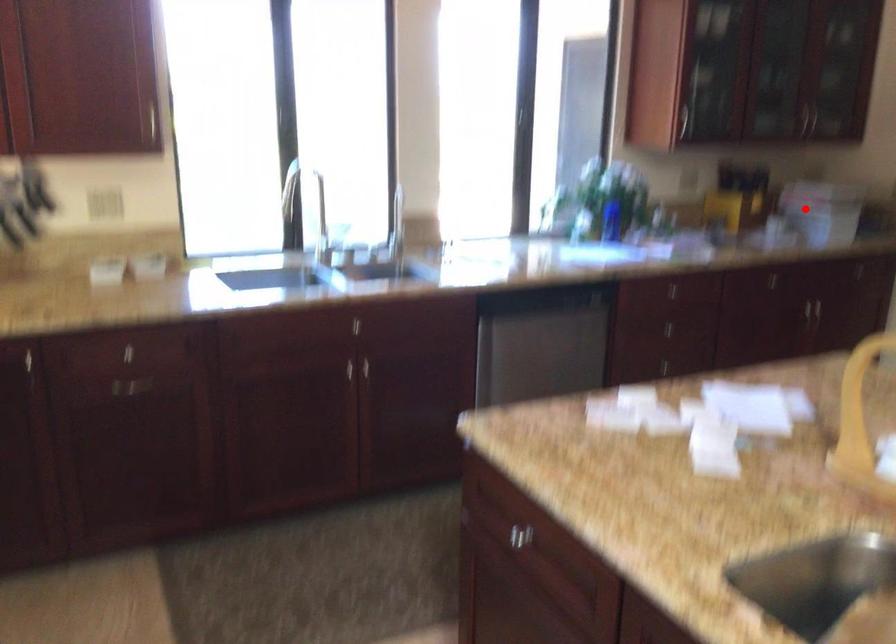
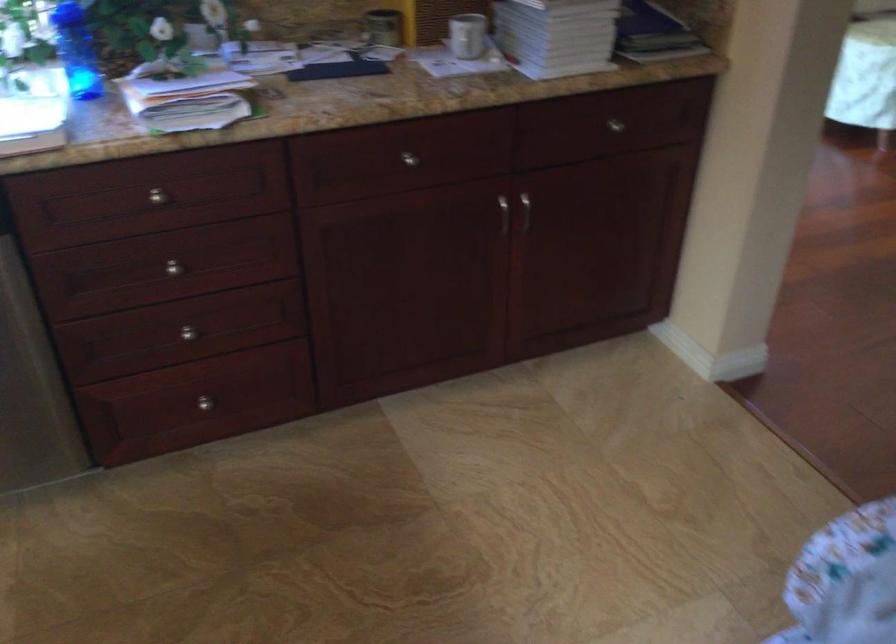
Find the pixel in the second image that matches the highlighted location in the first image.

(467, 35)